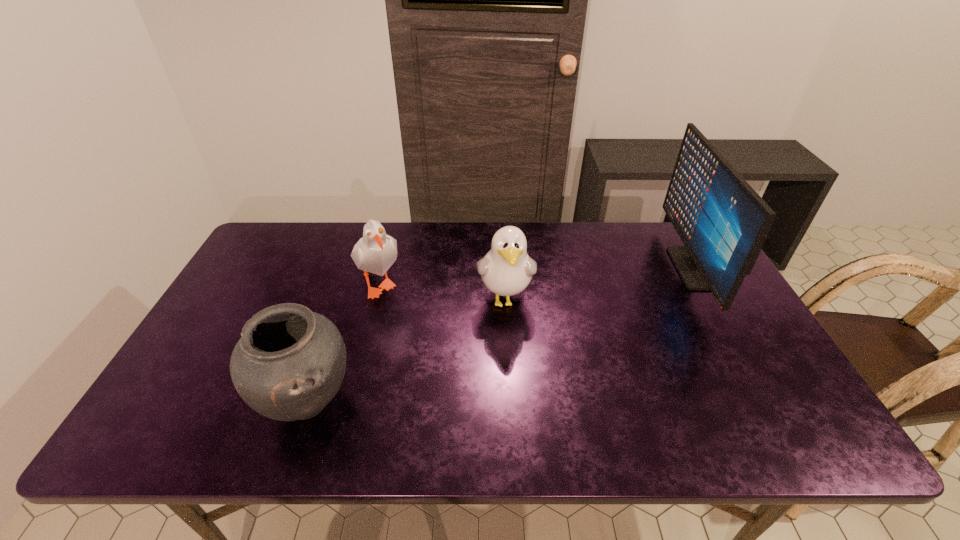
Select which object appears as the third closest to the third object from left to right. Please provide its 2D coordinates. Your answer should be formatted as a tuple, i.e. [(x, y)], where the tuple contains the x and y coordinates of a point satisfying the conditions above.

[(722, 221)]

Locate which object ranks second in proximity to the third object from left to right. Please provide its 2D coordinates. Your answer should be formatted as a tuple, i.e. [(x, y)], where the tuple contains the x and y coordinates of a point satisfying the conditions above.

[(290, 362)]

Where is `free space that satisfies the following two spatial constraints: 1. on the screen side of the computer monitor; 2. at the beak of the left gull`? This screenshot has width=960, height=540. free space that satisfies the following two spatial constraints: 1. on the screen side of the computer monitor; 2. at the beak of the left gull is located at coordinates (702, 282).